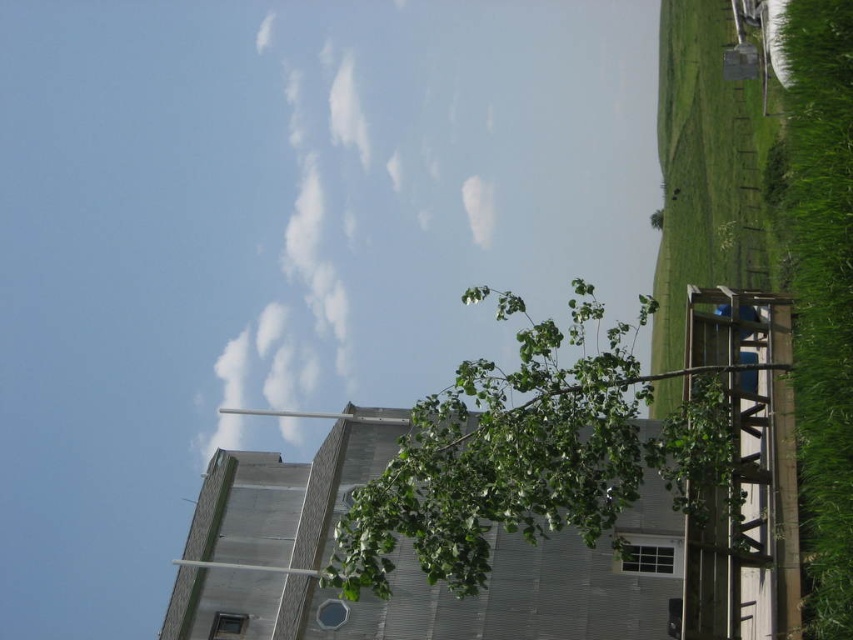
Question: Can you confirm if white fluffy cloud at upper center is thinner than green grass at right?

Choices:
 (A) yes
 (B) no

Answer: (B)

Question: Does green leafy tree at center appear under green leafy tree at upper right?

Choices:
 (A) no
 (B) yes

Answer: (B)

Question: Which point is farther from the camera taking this photo?

Choices:
 (A) (648, 220)
 (B) (850, 312)
 (C) (463, 417)

Answer: (A)

Question: Which point is closer to the camera?

Choices:
 (A) (798, 381)
 (B) (567, 445)
 (C) (405, 177)

Answer: (B)

Question: Does white fluffy cloud at upper center appear on the right side of green leafy tree at upper right?

Choices:
 (A) yes
 (B) no

Answer: (B)

Question: Estimate the real-world distances between objects in this image. Which object is closer to the green leafy tree at center?

Choices:
 (A) green leafy tree at upper right
 (B) green grass at right

Answer: (B)